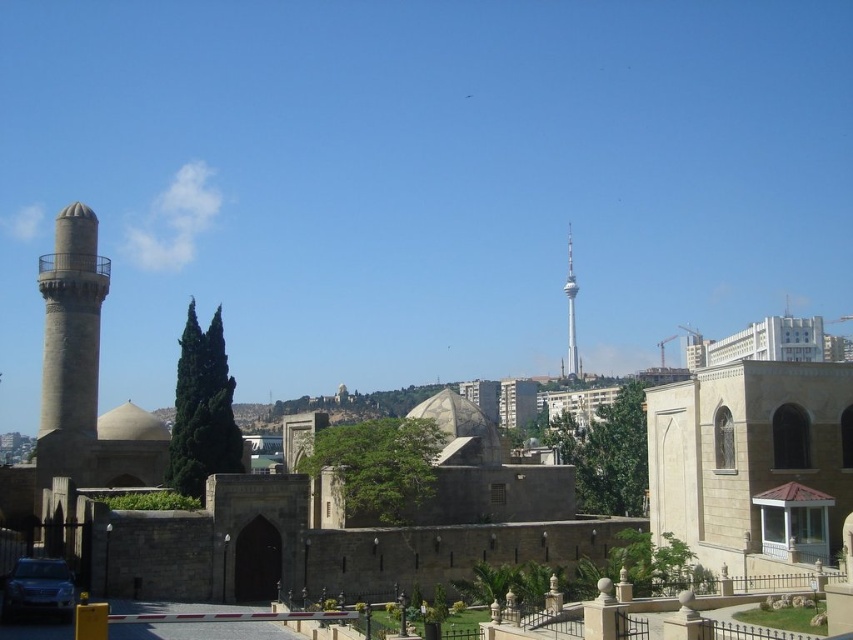
Question: Is silver metallic car at lower left below smooth silver tower at upper center?

Choices:
 (A) yes
 (B) no

Answer: (A)

Question: Which of these objects is positioned closest to the gray stone minaret at left?

Choices:
 (A) smooth silver tower at upper center
 (B) silver metallic car at lower left

Answer: (B)

Question: Observing the image, what is the correct spatial positioning of gray stone minaret at left in reference to silver metallic car at lower left?

Choices:
 (A) left
 (B) right

Answer: (A)

Question: Can you confirm if silver metallic car at lower left is positioned to the right of smooth silver tower at upper center?

Choices:
 (A) yes
 (B) no

Answer: (B)

Question: Which point appears closest to the camera in this image?

Choices:
 (A) (91, 328)
 (B) (18, 579)
 (C) (572, 352)

Answer: (B)

Question: Based on their relative distances, which object is farther from the gray stone minaret at left?

Choices:
 (A) silver metallic car at lower left
 (B) smooth silver tower at upper center

Answer: (B)